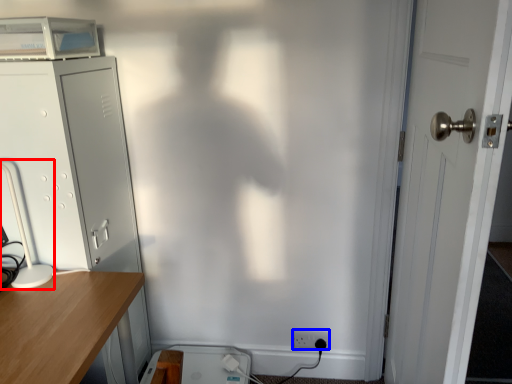
Question: Which object is further to the camera taking this photo, table lamp (highlighted by a red box) or electric outlet (highlighted by a blue box)?

Choices:
 (A) table lamp
 (B) electric outlet

Answer: (B)